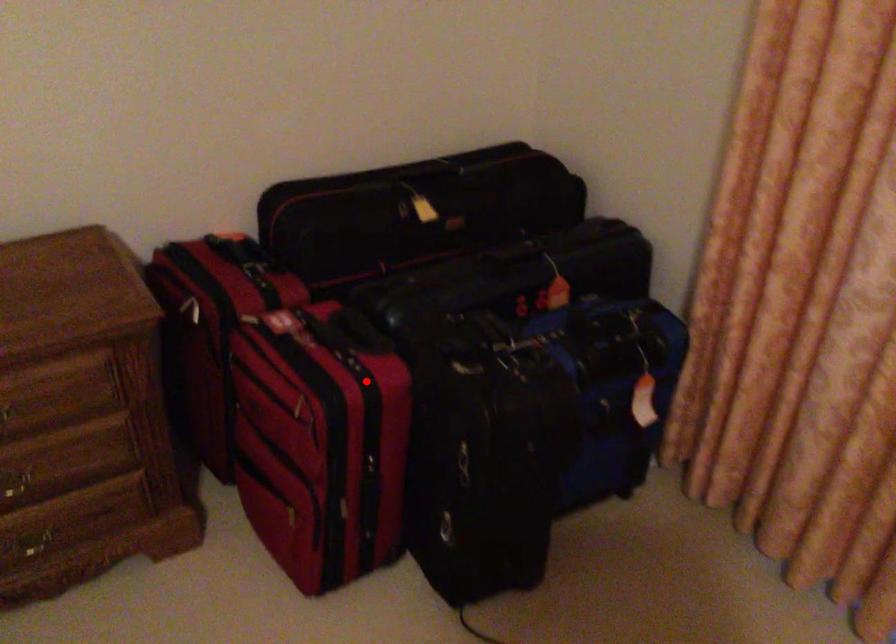
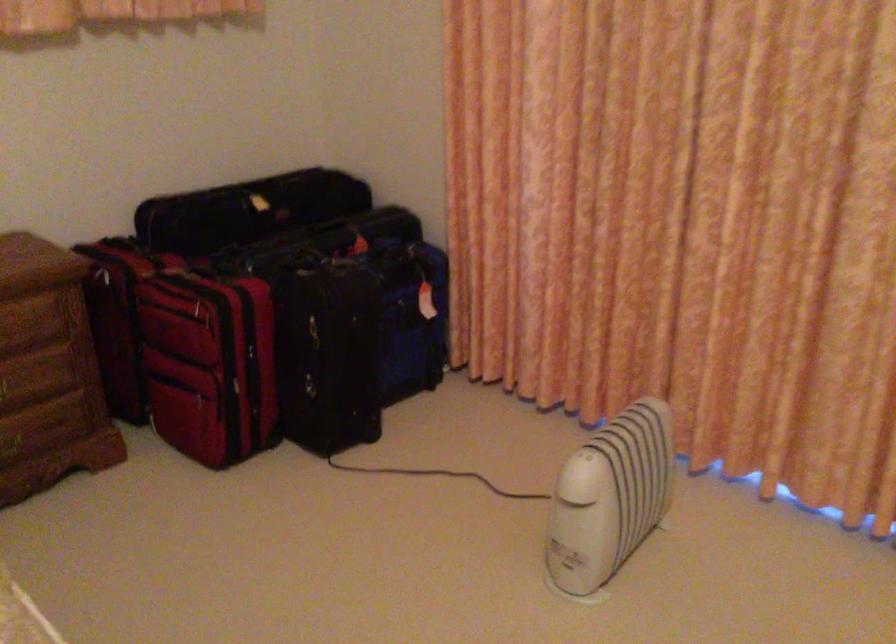
Question: I am providing you with two images of the same scene from different viewpoints. Image1 has a red point marked. In image2, the corresponding 3D location appears at what relative position? Reply with the corresponding letter.

Choices:
 (A) Closer
 (B) Farther

Answer: (B)